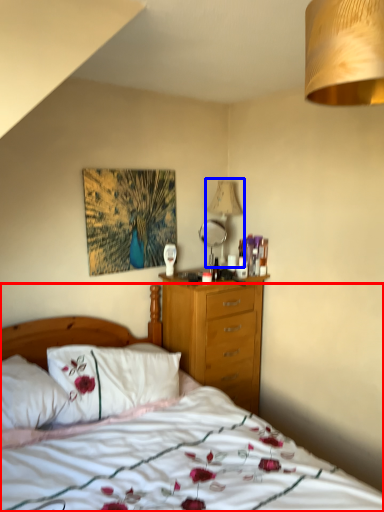
Question: Which of the following is the farthest to the observer, bed (highlighted by a red box) or lamp (highlighted by a blue box)?

Choices:
 (A) bed
 (B) lamp

Answer: (B)